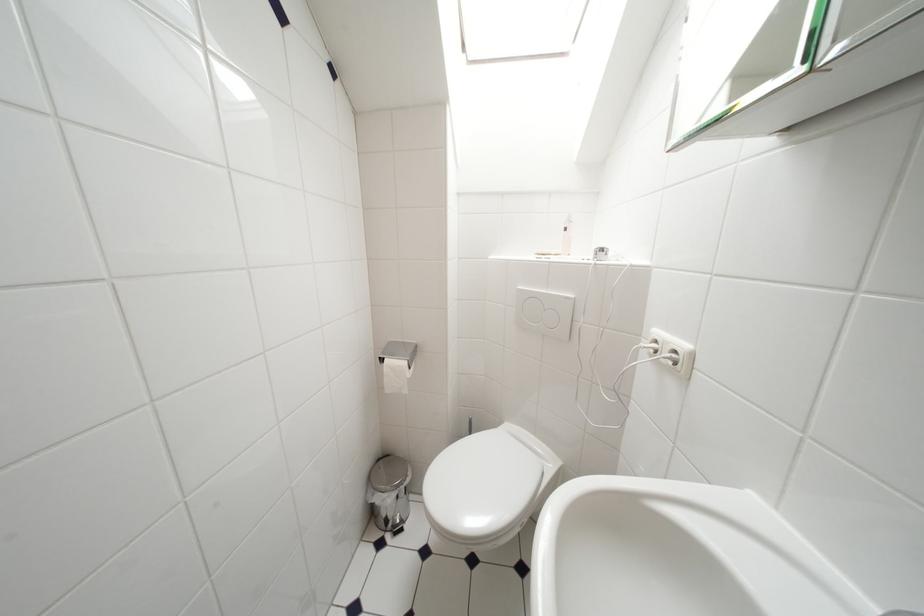
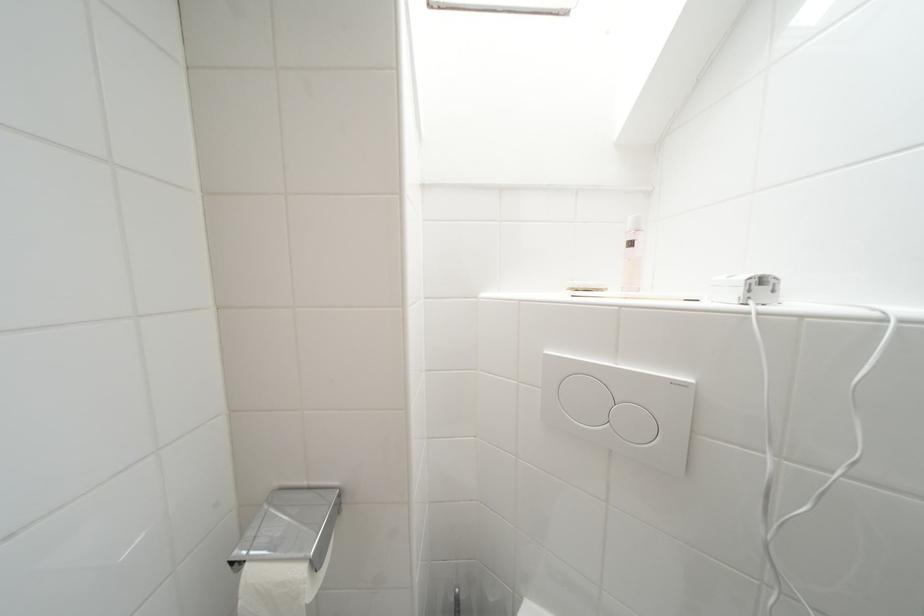
Find the pixel in the second image that matches the point at 609,253 in the first image.

(769, 283)